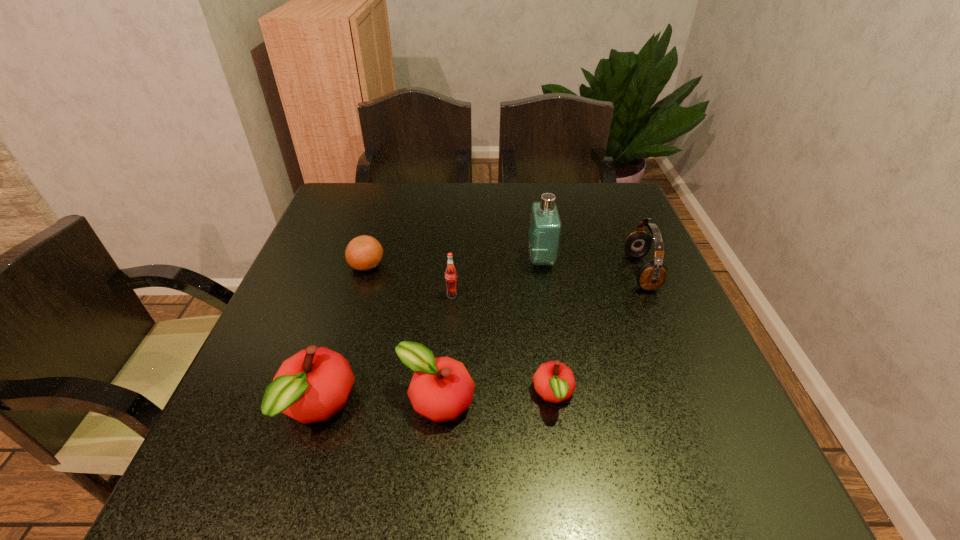
Locate an element on the screen. The height and width of the screenshot is (540, 960). free point located on the back of the shortest apple is located at coordinates (533, 251).

Locate an element on the screen. Image resolution: width=960 pixels, height=540 pixels. blank space located on the front label of the tallest object is located at coordinates (419, 259).

Where is `blank space located 0.380m on the front label of the tallest object`? The image size is (960, 540). blank space located 0.380m on the front label of the tallest object is located at coordinates (379, 259).

Find the location of `vacant space positioned on the front label of the tallest object`. vacant space positioned on the front label of the tallest object is located at coordinates (473, 259).

Locate an element on the screen. Image resolution: width=960 pixels, height=540 pixels. vacant area situated 0.060m on the label of the soda bottle is located at coordinates (450, 318).

Image resolution: width=960 pixels, height=540 pixels. I want to click on blank space located 0.250m on the back of the clementine, so click(x=386, y=202).

Where is `free spot located on the ear cups of the headset`? Image resolution: width=960 pixels, height=540 pixels. free spot located on the ear cups of the headset is located at coordinates (535, 272).

The image size is (960, 540). Find the location of `vacant space located 0.340m on the ear cups of the headset`. vacant space located 0.340m on the ear cups of the headset is located at coordinates (490, 272).

You are a GUI agent. You are given a task and a screenshot of the screen. Output one action in this format:
    pyautogui.click(x=<x>, y=<y>)
    Task: Click on the blank space located 0.060m on the ear cups of the headset
    The image size is (960, 540).
    Given the screenshot: What is the action you would take?
    pyautogui.click(x=603, y=272)

You are a GUI agent. You are given a task and a screenshot of the screen. Output one action in this format:
    pyautogui.click(x=<x>, y=<y>)
    Task: Click on the apple present at the left edge
    
    Given the screenshot: What is the action you would take?
    pyautogui.click(x=311, y=386)